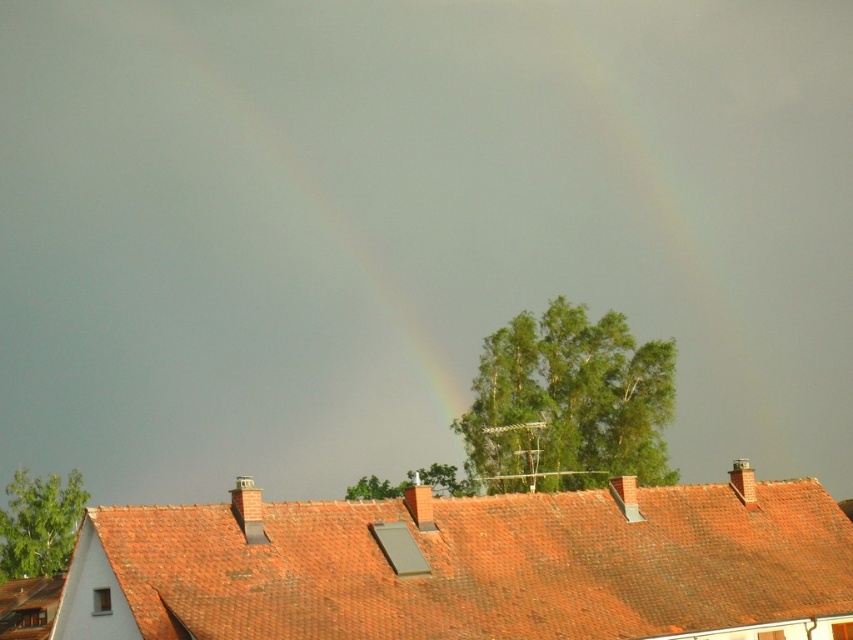
Question: Which point appears closest to the camera in this image?

Choices:
 (A) (405, 298)
 (B) (209, 532)

Answer: (B)

Question: Considering the relative positions of red tile roof at center and rainbow at upper center in the image provided, where is red tile roof at center located with respect to rainbow at upper center?

Choices:
 (A) below
 (B) above

Answer: (A)

Question: Does red tile roof at center appear on the right side of rainbow at upper center?

Choices:
 (A) no
 (B) yes

Answer: (B)

Question: Is red tile roof at center positioned behind rainbow at upper center?

Choices:
 (A) yes
 (B) no

Answer: (B)